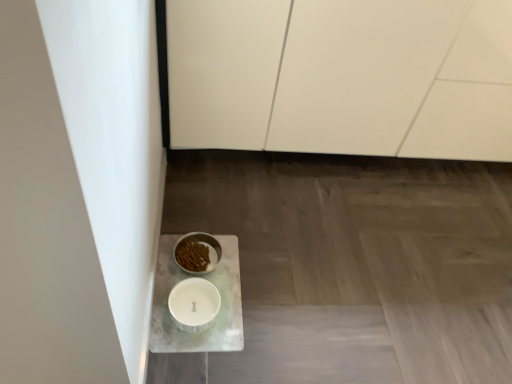
The width and height of the screenshot is (512, 384). Identify the location of vacant space behind white glossy bowl at lower left, acting as the 2th tableware starting from the bottom. (207, 214).